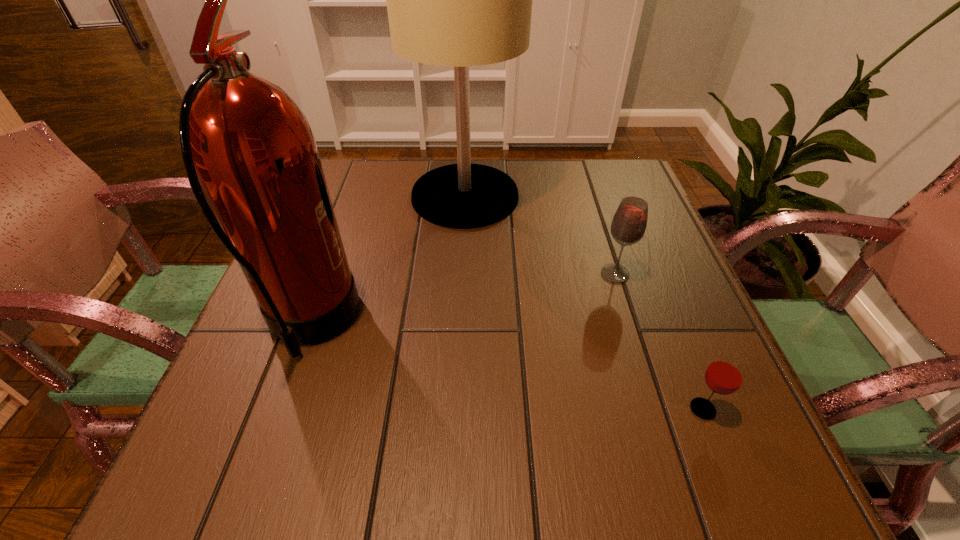
The image size is (960, 540). In order to click on the second object from left to right in this screenshot , I will do `click(459, 0)`.

Image resolution: width=960 pixels, height=540 pixels. Find the location of `the farthest object`. the farthest object is located at coordinates (459, 0).

You are a GUI agent. You are given a task and a screenshot of the screen. Output one action in this format:
    pyautogui.click(x=<x>, y=<y>)
    Task: Click on the leftmost object
    The height and width of the screenshot is (540, 960).
    Given the screenshot: What is the action you would take?
    pyautogui.click(x=244, y=141)

At what (x,y) coordinates should I click in order to perform the action: click on the farther glass. Please return your answer as a coordinate pair (x, y). Looking at the image, I should click on (628, 226).

I want to click on the taller glass, so click(628, 226).

At what (x,y) coordinates should I click in order to perform the action: click on the shortest object. Please return your answer as a coordinate pair (x, y). The image size is (960, 540). Looking at the image, I should click on (725, 374).

Where is `the rightmost object`? This screenshot has height=540, width=960. the rightmost object is located at coordinates (725, 374).

Image resolution: width=960 pixels, height=540 pixels. I want to click on vacant space located on the front of the table lamp, so click(461, 290).

Where is `blank space located on the front-facing side of the leftmost object`? blank space located on the front-facing side of the leftmost object is located at coordinates (531, 324).

Identify the location of vacant space located on the front of the taller glass. This screenshot has height=540, width=960. (641, 357).